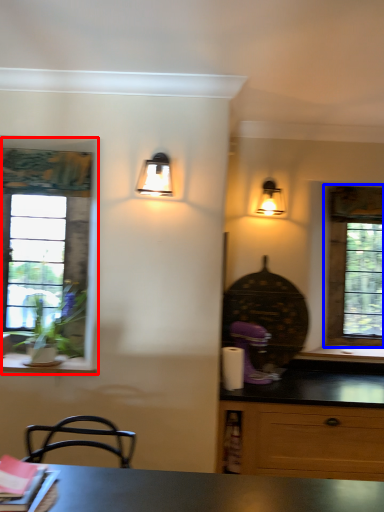
Question: Which of the following is the farthest to the observer, window (highlighted by a red box) or window (highlighted by a blue box)?

Choices:
 (A) window
 (B) window

Answer: (B)